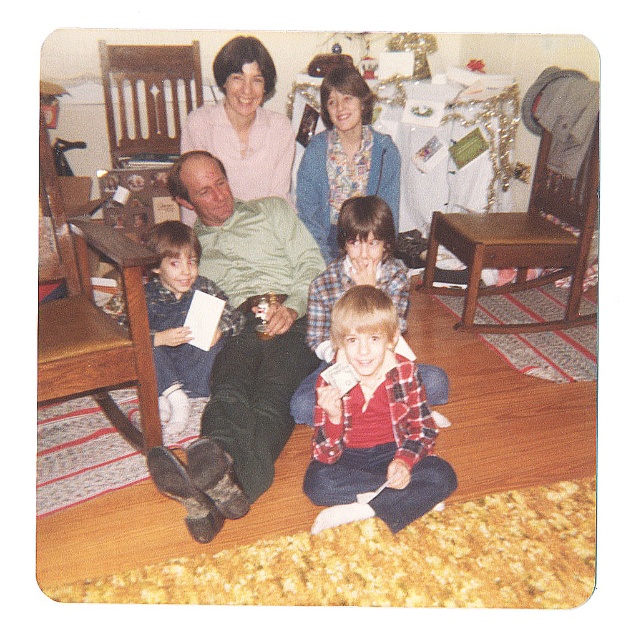
You are trying to decide which item is better suited to sit on for a short rest. Based on their thickness, which one would you choose between the matte green sweater at center and the wooden rocking chair at upper right?

The wooden rocking chair at upper right is thicker than the matte green sweater at center, so it would be more suitable for sitting on as a short rest.